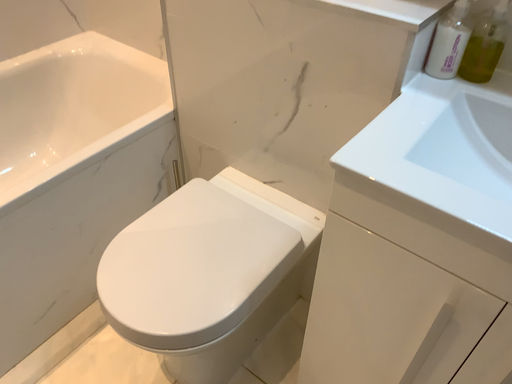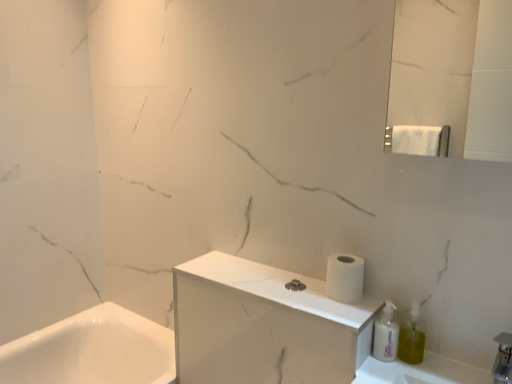
Question: How did the camera likely rotate when shooting the video?

Choices:
 (A) rotated upward
 (B) rotated downward

Answer: (A)